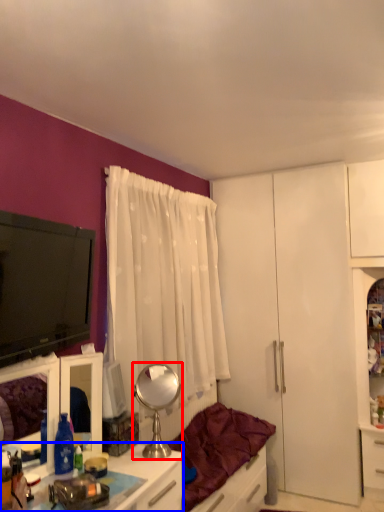
Question: Among these objects, which one is nearest to the camera, mirror (highlighted by a red box) or desk (highlighted by a blue box)?

Choices:
 (A) mirror
 (B) desk

Answer: (B)